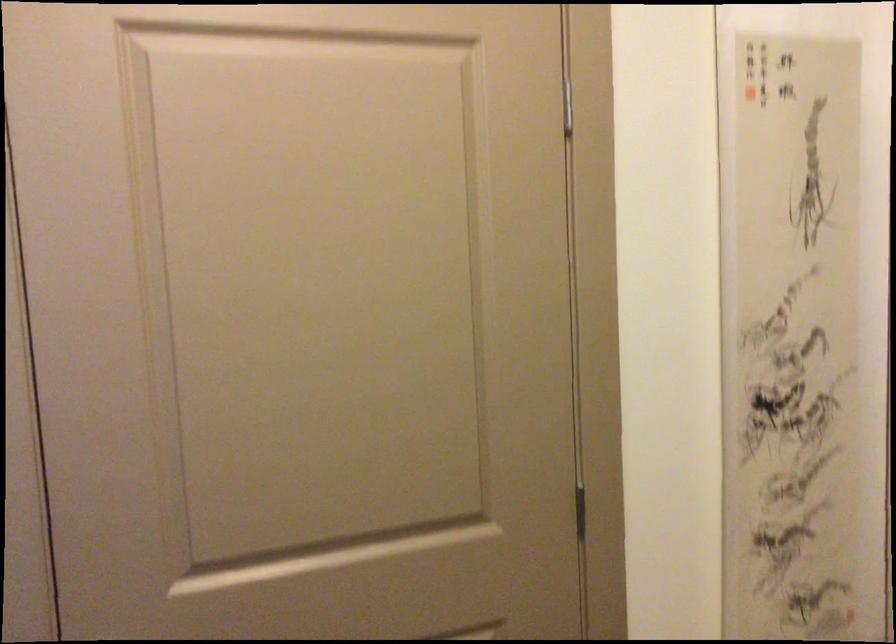
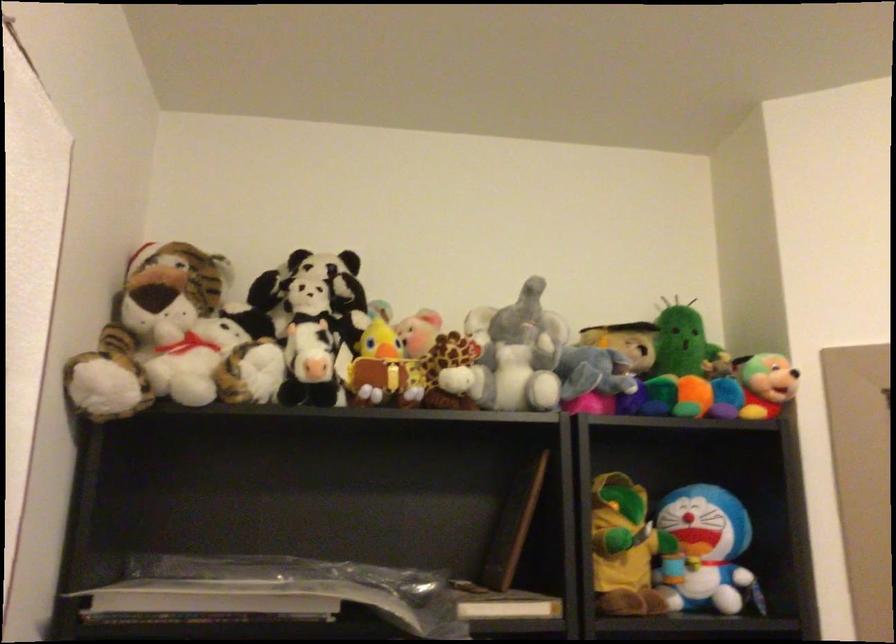
Based on the continuous images, in which direction is the camera rotating?

The camera's rotation is toward right-up.